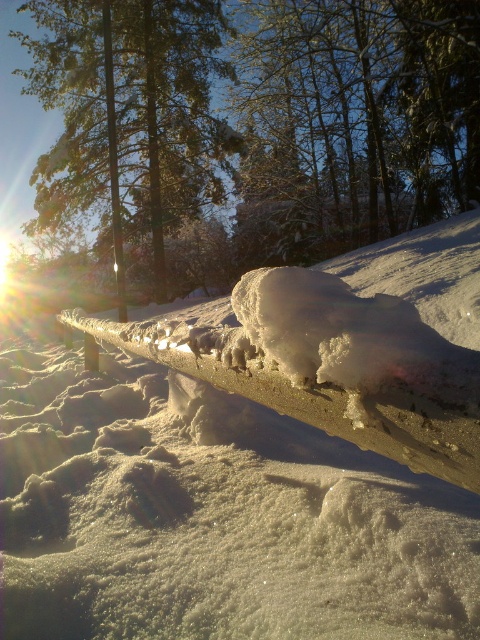
Between green textured tree at center and green textured pine tree at upper center, which one has more height?

With more height is green textured pine tree at upper center.

Who is more distant from viewer, (356, 35) or (192, 93)?

Answer: Point (192, 93)

In order to click on green textured tree at center in this screenshot , I will do `click(299, 116)`.

I want to click on green textured tree at center, so click(x=299, y=116).

In the scene shown: Between white frosty snow at center and green textured pine tree at upper center, which one is positioned higher?

Positioned higher is green textured pine tree at upper center.

Which is in front, point (204, 540) or point (70, 164)?

Point (204, 540) is more forward.

Where is `white frosty snow at center`? white frosty snow at center is located at coordinates (212, 516).

Is white frosty snow at center bigger than green textured tree at center?

Actually, white frosty snow at center might be smaller than green textured tree at center.

At what (x,y) coordinates should I click in order to perform the action: click on white frosty snow at center. Please return your answer as a coordinate pair (x, y). Looking at the image, I should click on (212, 516).